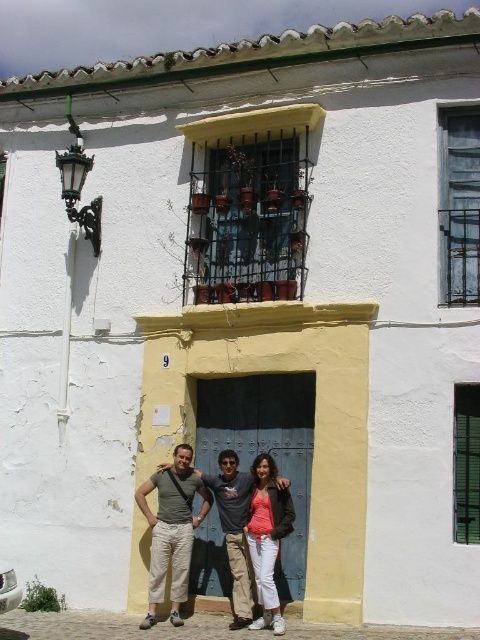
You are a fashion designer observing the scene. You notice the beige cotton pants at center and the matte pink shirt at center. Which clothing item would you recommend to a client who prefers items with a more substantial presence in terms of size?

The beige cotton pants at center is larger in size than the matte pink shirt at center, so I would recommend the beige cotton pants at center for a more substantial presence.

You are a photographer positioned in front of the traditional white building with the yellow archway. You notice the beige cotton pants at center and the matte pink shirt at center. Which clothing item is closer to you?

The beige cotton pants at center is closer to you because the matte pink shirt at center is behind it.

You are a tailor observing two pairs of pants in the image. The matte gray pants at center and the beige cotton pants at center. Which pair has a larger size?

The beige cotton pants at center is larger than the matte gray pants at center.